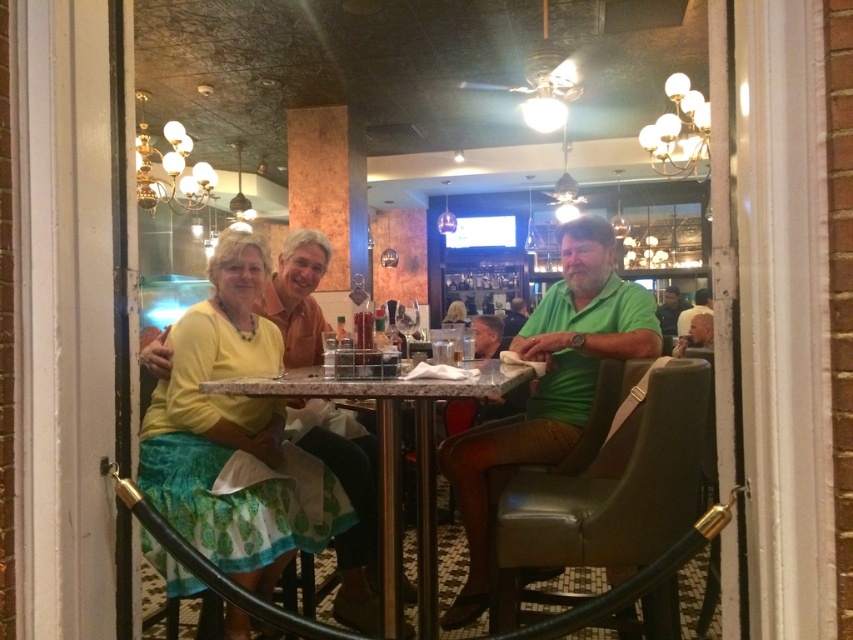
Is green matte shirt at center to the right of green cotton shirt at right from the viewer's perspective?

In fact, green matte shirt at center is to the left of green cotton shirt at right.

Can you confirm if green matte shirt at center is positioned above green cotton shirt at right?

No, green matte shirt at center is not above green cotton shirt at right.

Who is more distant from viewer, (657, 340) or (660, 326)?

Positioned behind is point (660, 326).

This screenshot has width=853, height=640. In order to click on green matte shirt at center in this screenshot , I will do `click(549, 387)`.

Which is more to the left, marble table at center or green cotton shirt at right?

marble table at center

Is marble table at center shorter than green cotton shirt at right?

In fact, marble table at center may be taller than green cotton shirt at right.

Is point (309, 381) positioned in front of point (663, 324)?

Yes, it is.

Locate an element on the screen. This screenshot has height=640, width=853. marble table at center is located at coordinates (396, 461).

Is green matte shirt at center to the right of green fabric shirt at center from the viewer's perspective?

No, green matte shirt at center is not to the right of green fabric shirt at center.

Is green matte shirt at center positioned before green fabric shirt at center?

Yes, green matte shirt at center is closer to the viewer.

Does point (459, 621) lie in front of point (514, 333)?

Yes, point (459, 621) is closer to viewer.

Where is `green matte shirt at center`? green matte shirt at center is located at coordinates (549, 387).